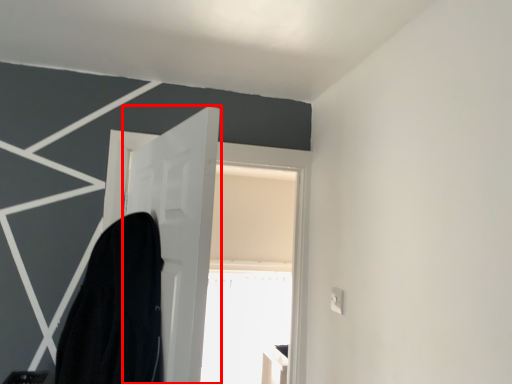
Question: From the image's perspective, what is the correct spatial relationship of door (annotated by the red box) in relation to robe?

Choices:
 (A) above
 (B) below

Answer: (A)